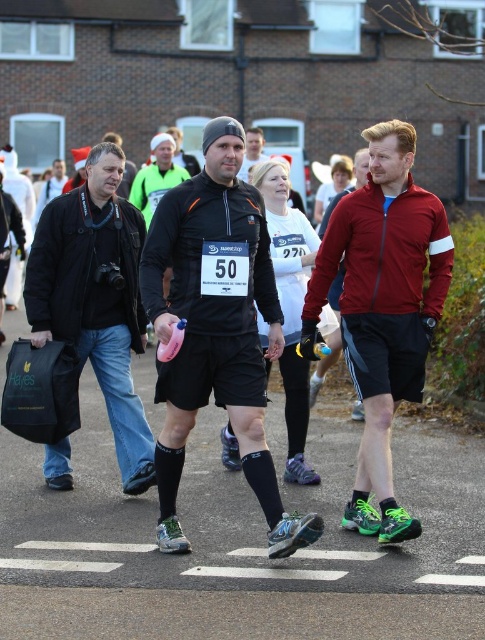
Question: Is matte black shorts at center wider than matte red jacket at center?

Choices:
 (A) no
 (B) yes

Answer: (B)

Question: Which of the following is the closest to the observer?

Choices:
 (A) (86, 224)
 (B) (341, 573)
 (C) (294, 362)

Answer: (B)

Question: Does black matte jacket at left appear on the left side of black matte running shorts at center?

Choices:
 (A) yes
 (B) no

Answer: (A)

Question: Which object is the farthest from the black matte jacket at left?

Choices:
 (A) black matte running shorts at center
 (B) white asphalt at center
 (C) matte red jacket at center

Answer: (B)

Question: Which of these objects is positioned closest to the black matte running shorts at center?

Choices:
 (A) black matte jacket at left
 (B) matte red jacket at center
 (C) white asphalt at center
 (D) matte black shorts at center

Answer: (D)

Question: Is matte red jacket at center bigger than white asphalt at center?

Choices:
 (A) no
 (B) yes

Answer: (B)